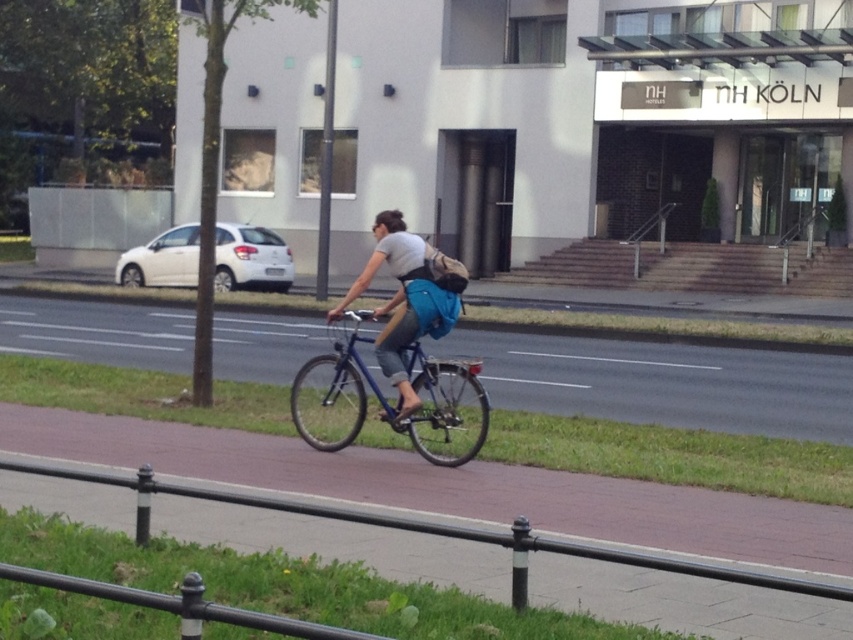
Question: Considering the real-world distances, which object is closest to the blue metallic bicycle at center?

Choices:
 (A) blue fabric backpack at center
 (B) black metal rail at lower center
 (C) smooth concrete pavement at center

Answer: (A)

Question: Among these objects, which one is farthest from the camera?

Choices:
 (A) smooth concrete pavement at center
 (B) blue metallic bicycle at center
 (C) blue fabric backpack at center
 (D) black metal rail at lower center

Answer: (A)

Question: Does smooth concrete pavement at center have a smaller size compared to blue metallic bicycle at center?

Choices:
 (A) no
 (B) yes

Answer: (A)

Question: Among these points, which one is nearest to the camera?

Choices:
 (A) (328, 404)
 (B) (492, 536)
 (C) (456, 304)
 (D) (286, 381)

Answer: (B)

Question: Does smooth concrete pavement at center come behind blue fabric backpack at center?

Choices:
 (A) no
 (B) yes

Answer: (B)

Question: Where is smooth concrete pavement at center located in relation to black metal rail at lower center in the image?

Choices:
 (A) left
 (B) right

Answer: (A)